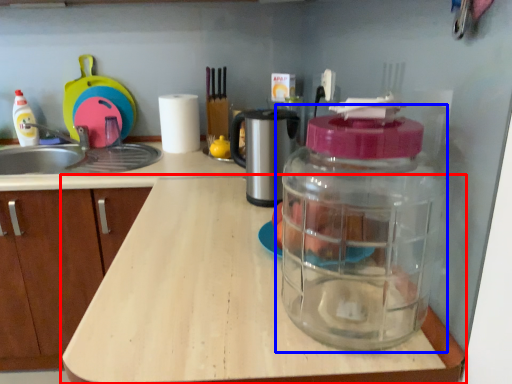
Question: Which point is further to the camera, countertop (highlighted by a red box) or bottle (highlighted by a blue box)?

Choices:
 (A) countertop
 (B) bottle

Answer: (A)